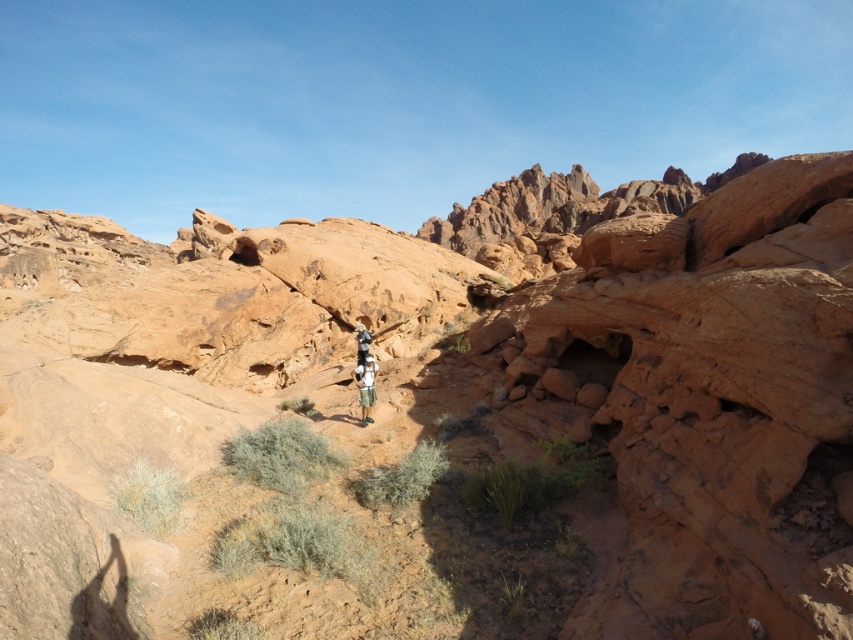
Question: Which of the following is the closest to the observer?

Choices:
 (A) (367, 371)
 (B) (369, 333)

Answer: (A)

Question: Which point is closer to the camera?

Choices:
 (A) [352, 374]
 (B) [361, 330]

Answer: (B)

Question: Can you confirm if camouflage fabric shorts at center is positioned above white cotton shirt at center?

Choices:
 (A) no
 (B) yes

Answer: (A)

Question: Is camouflage fabric shorts at center above white cotton shirt at center?

Choices:
 (A) no
 (B) yes

Answer: (A)

Question: Is camouflage fabric shorts at center to the right of white cotton shirt at center from the viewer's perspective?

Choices:
 (A) yes
 (B) no

Answer: (A)